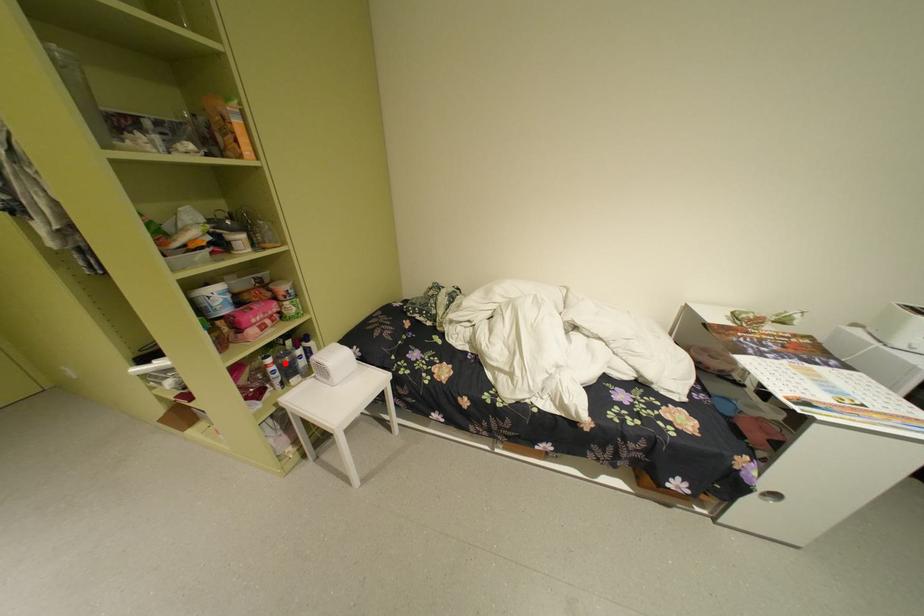
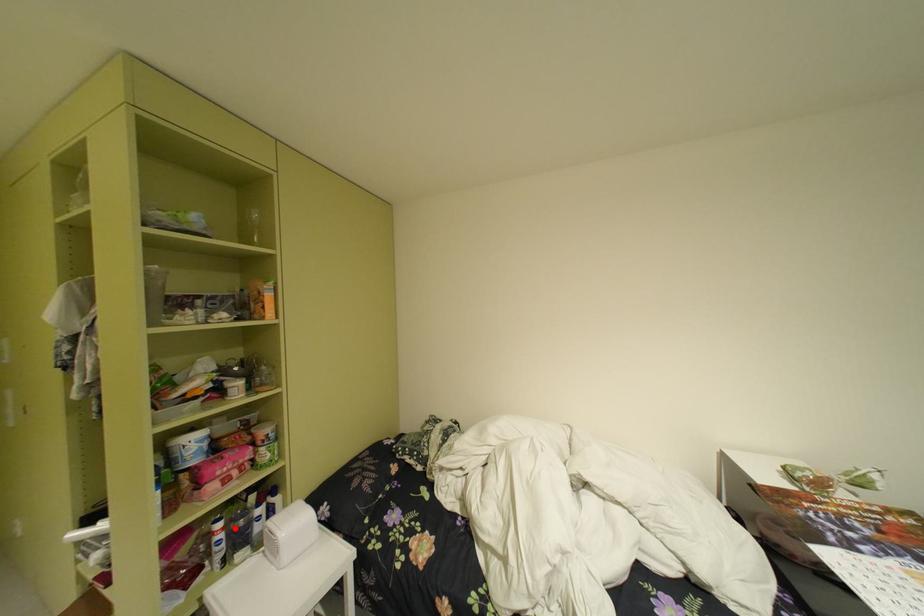
I am providing you with two images of the same scene from different viewpoints. A red point is marked on the first image and another point is marked on the second image. Is the marked point in image1 the same physical position as the marked point in image2?

Yes